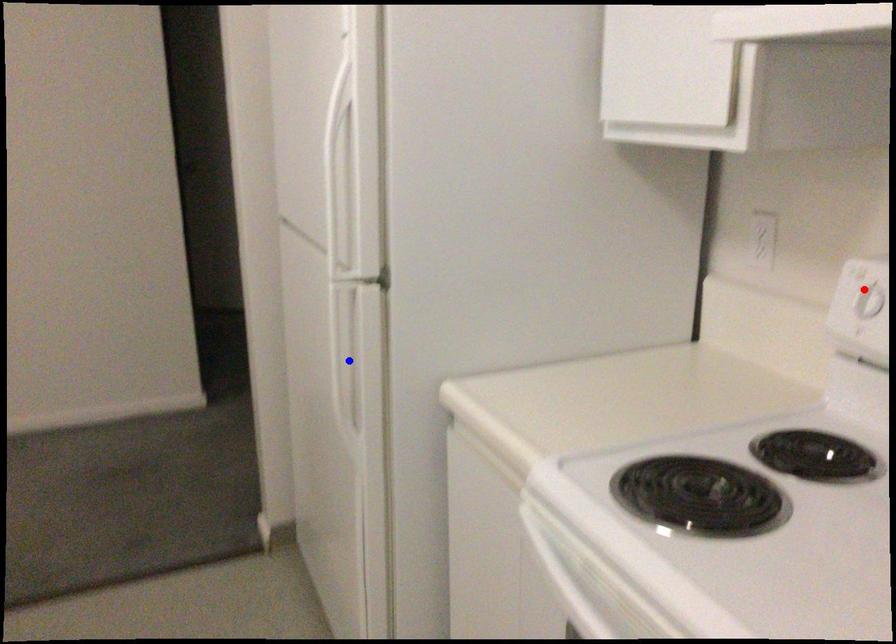
Question: Which of the two points in the image is closer to the camera?

Choices:
 (A) Blue point is closer.
 (B) Red point is closer.

Answer: (B)